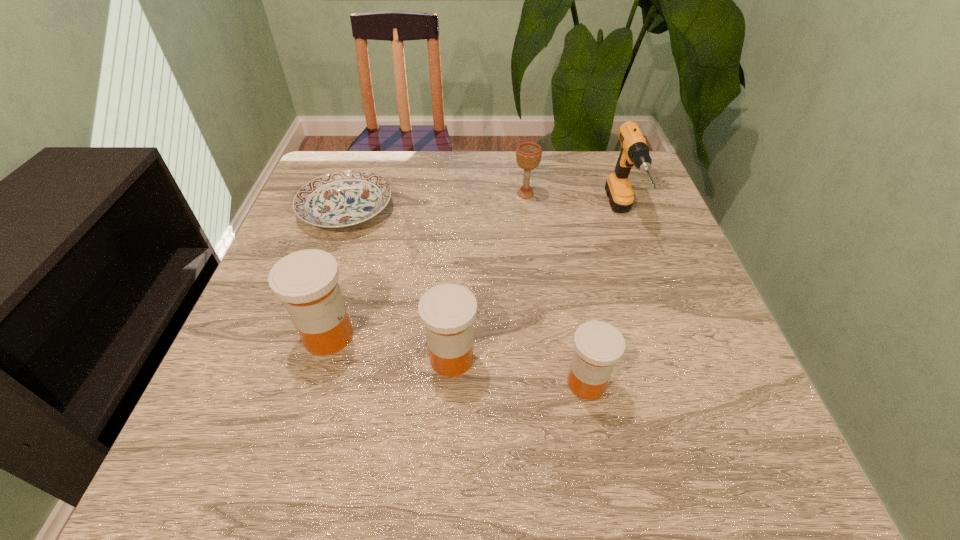
This screenshot has height=540, width=960. I want to click on vacant region at the near edge, so click(552, 384).

You are a GUI agent. You are given a task and a screenshot of the screen. Output one action in this format:
    pyautogui.click(x=<x>, y=<y>)
    Task: Click on the free space at the left edge of the desktop
    This screenshot has width=960, height=540.
    Given the screenshot: What is the action you would take?
    pyautogui.click(x=278, y=306)

The width and height of the screenshot is (960, 540). In the image, there is a desktop. What are the coordinates of `vacant space at the right edge` in the screenshot? It's located at (654, 268).

At what (x,y) coordinates should I click in order to perform the action: click on vacant space at the far left corner of the desktop. Please return your answer as a coordinate pair (x, y). The height and width of the screenshot is (540, 960). Looking at the image, I should click on (353, 154).

Locate an element on the screen. The image size is (960, 540). vacant space at the far right corner of the desktop is located at coordinates (583, 160).

At what (x,y) coordinates should I click in order to perform the action: click on vacant space in between the fourth object from right to left and the shortest object. Please return your answer as a coordinate pair (x, y). This screenshot has width=960, height=540. Looking at the image, I should click on (399, 284).

This screenshot has height=540, width=960. Find the location of `unoccupied position between the chalice and the third object from left to right`. unoccupied position between the chalice and the third object from left to right is located at coordinates (489, 276).

Find the location of a particular element. vacant space that is in between the chalice and the shortest medicine is located at coordinates (556, 288).

Find the location of a particular element. This screenshot has width=960, height=540. free spot between the leftmost medicine and the second tallest medicine is located at coordinates pyautogui.click(x=390, y=347).

Locate an element on the screen. free space between the leftmost medicine and the second tallest medicine is located at coordinates (390, 347).